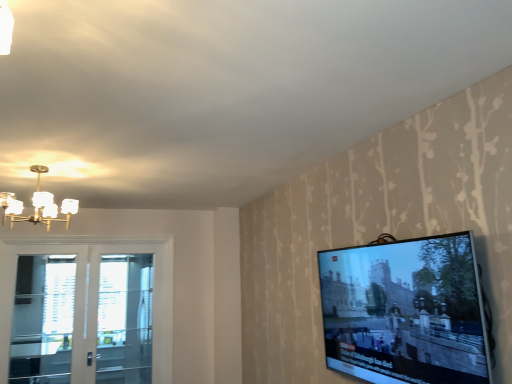
Locate an element on the screen. Image resolution: width=512 pixels, height=384 pixels. white glass door at left is located at coordinates (95, 296).

The height and width of the screenshot is (384, 512). What are the coordinates of `flat screen tv at right` in the screenshot? It's located at (405, 312).

Where is `clear glass door at left, the first screen door positioned from the right`? clear glass door at left, the first screen door positioned from the right is located at coordinates (125, 319).

The width and height of the screenshot is (512, 384). I want to click on matte glass chandelier at upper left, so click(37, 205).

Which object is thinner, clear glass door at left, the first screen door positioned from the right, or white glass door at left?

Thinner between the two is clear glass door at left, the first screen door positioned from the right.

Is clear glass door at left, acting as the 2th screen door starting from the left, facing away from white glass door at left?

Absolutely, clear glass door at left, acting as the 2th screen door starting from the left, is directed away from white glass door at left.

Can we say clear glass door at left, the first screen door positioned from the right, lies outside white glass door at left?

No, clear glass door at left, the first screen door positioned from the right, is inside or overlapping with white glass door at left.

Is point (116, 347) farther from viewer compared to point (160, 320)?

Yes, point (116, 347) is farther from viewer.

From a real-world perspective, is clear glass door at left, acting as the 2th screen door starting from the left, physically below flat screen tv at right?

Indeed, from a real-world perspective, clear glass door at left, acting as the 2th screen door starting from the left, is positioned beneath flat screen tv at right.

Is clear glass door at left, the first screen door positioned from the right, placed right next to flat screen tv at right?

No, clear glass door at left, the first screen door positioned from the right, is not with flat screen tv at right.

Which object is further away from the camera taking this photo, clear glass door at left, acting as the 2th screen door starting from the left, or flat screen tv at right?

clear glass door at left, acting as the 2th screen door starting from the left.

Based on the photo, could you tell me if clear glass door at left, acting as the 2th screen door starting from the left, is facing clear glass screen door at left, the 1th screen door from the left?

No, clear glass door at left, acting as the 2th screen door starting from the left, is not aimed at clear glass screen door at left, the 1th screen door from the left.

Are clear glass door at left, the first screen door positioned from the right, and clear glass screen door at left, the 2th screen door in the right-to-left sequence, beside each other?

clear glass door at left, the first screen door positioned from the right, and clear glass screen door at left, the 2th screen door in the right-to-left sequence, are clearly separated.

In the image, is clear glass door at left, acting as the 2th screen door starting from the left, positioned in front of or behind clear glass screen door at left, the 2th screen door in the right-to-left sequence?

clear glass door at left, acting as the 2th screen door starting from the left, is positioned farther from the viewer than clear glass screen door at left, the 2th screen door in the right-to-left sequence.

Which is more to the right, matte glass chandelier at upper left or clear glass screen door at left, the 1th screen door from the left?

From the viewer's perspective, matte glass chandelier at upper left appears more on the right side.

How many degrees apart are the facing directions of matte glass chandelier at upper left and clear glass screen door at left, the 1th screen door from the left?

90.2 degrees separate the facing orientations of matte glass chandelier at upper left and clear glass screen door at left, the 1th screen door from the left.

Considering the relative sizes of matte glass chandelier at upper left and clear glass screen door at left, the 2th screen door in the right-to-left sequence, in the image provided, is matte glass chandelier at upper left thinner than clear glass screen door at left, the 2th screen door in the right-to-left sequence,?

Incorrect, the width of matte glass chandelier at upper left is not less than that of clear glass screen door at left, the 2th screen door in the right-to-left sequence.

Can you confirm if matte glass chandelier at upper left is shorter than clear glass screen door at left, the 1th screen door from the left?

Correct, matte glass chandelier at upper left is not as tall as clear glass screen door at left, the 1th screen door from the left.

Is white glass door at left inside the boundaries of clear glass screen door at left, the 1th screen door from the left, or outside?

white glass door at left is located beyond the bounds of clear glass screen door at left, the 1th screen door from the left.

Considering the relative sizes of white glass door at left and clear glass screen door at left, the 2th screen door in the right-to-left sequence, in the image provided, is white glass door at left wider than clear glass screen door at left, the 2th screen door in the right-to-left sequence,?

Yes, white glass door at left is wider than clear glass screen door at left, the 2th screen door in the right-to-left sequence.

I want to click on screen door to the left of white glass door at left, so (42, 320).

Considering the relative sizes of white glass door at left and clear glass screen door at left, the 1th screen door from the left, in the image provided, is white glass door at left shorter than clear glass screen door at left, the 1th screen door from the left,?

Incorrect, the height of white glass door at left does not fall short of that of clear glass screen door at left, the 1th screen door from the left.

Looking at this image, from a real-world perspective, which object rests below the other?

white glass door at left is physically lower.

Considering the relative sizes of matte glass chandelier at upper left and white glass door at left in the image provided, is matte glass chandelier at upper left shorter than white glass door at left?

Yes.

Based on the photo, can you confirm if matte glass chandelier at upper left is wider than white glass door at left?

Yes, matte glass chandelier at upper left is wider than white glass door at left.

Is matte glass chandelier at upper left facing towards white glass door at left?

No, matte glass chandelier at upper left is not aimed at white glass door at left.

From a real-world perspective, which object stands above the other?

In real-world perspective, flat screen tv at right is above.

Locate an element on the screen. The image size is (512, 384). television on the right of clear glass door at left, acting as the 2th screen door starting from the left is located at coordinates (405, 312).

Is flat screen tv at right positioned with its back to clear glass door at left, acting as the 2th screen door starting from the left?

No, clear glass door at left, acting as the 2th screen door starting from the left, is not at the back of flat screen tv at right.

From the image's perspective, between flat screen tv at right and clear glass door at left, acting as the 2th screen door starting from the left, which one is located above?

flat screen tv at right appears higher in the image.

Find the location of `screen door that is on the right side of white glass door at left`. screen door that is on the right side of white glass door at left is located at coordinates coord(125,319).

I want to click on television above the clear glass door at left, the first screen door positioned from the right (from the image's perspective), so click(x=405, y=312).

When comparing their distances from clear glass door at left, the first screen door positioned from the right, does matte glass chandelier at upper left or flat screen tv at right seem closer?

matte glass chandelier at upper left is positioned closer to the anchor clear glass door at left, the first screen door positioned from the right.

Considering their positions, is white glass door at left positioned closer to matte glass chandelier at upper left than clear glass door at left, acting as the 2th screen door starting from the left?

white glass door at left.

Based on their spatial positions, is clear glass screen door at left, the 1th screen door from the left, or matte glass chandelier at upper left further from flat screen tv at right?

The object further to flat screen tv at right is clear glass screen door at left, the 1th screen door from the left.

When comparing their distances from clear glass door at left, acting as the 2th screen door starting from the left, does clear glass screen door at left, the 1th screen door from the left, or flat screen tv at right seem further?

flat screen tv at right is positioned further to the anchor clear glass door at left, acting as the 2th screen door starting from the left.

Which object lies further to the anchor point clear glass door at left, acting as the 2th screen door starting from the left, flat screen tv at right or clear glass screen door at left, the 1th screen door from the left?

flat screen tv at right.

When comparing their distances from matte glass chandelier at upper left, does clear glass door at left, acting as the 2th screen door starting from the left, or white glass door at left seem further?

clear glass door at left, acting as the 2th screen door starting from the left.

When comparing their distances from clear glass door at left, acting as the 2th screen door starting from the left, does white glass door at left or clear glass screen door at left, the 2th screen door in the right-to-left sequence, seem closer?

white glass door at left is closer to clear glass door at left, acting as the 2th screen door starting from the left.

Looking at the image, which one is located closer to white glass door at left, clear glass door at left, acting as the 2th screen door starting from the left, or flat screen tv at right?

The object closer to white glass door at left is clear glass door at left, acting as the 2th screen door starting from the left.

Locate an element on the screen. window positioned between matte glass chandelier at upper left and clear glass screen door at left, the 1th screen door from the left, from near to far is located at coordinates (x=95, y=296).

What are the coordinates of `light fixture located between clear glass screen door at left, the 1th screen door from the left, and flat screen tv at right in the left-right direction` in the screenshot? It's located at (37, 205).

At what (x,y) coordinates should I click in order to perform the action: click on screen door located between matte glass chandelier at upper left and clear glass door at left, the first screen door positioned from the right, in the depth direction. Please return your answer as a coordinate pair (x, y). Looking at the image, I should click on (42, 320).

You are a GUI agent. You are given a task and a screenshot of the screen. Output one action in this format:
    pyautogui.click(x=<x>, y=<y>)
    Task: Click on the window between clear glass screen door at left, the 1th screen door from the left, and flat screen tv at right
    
    Given the screenshot: What is the action you would take?
    pyautogui.click(x=95, y=296)